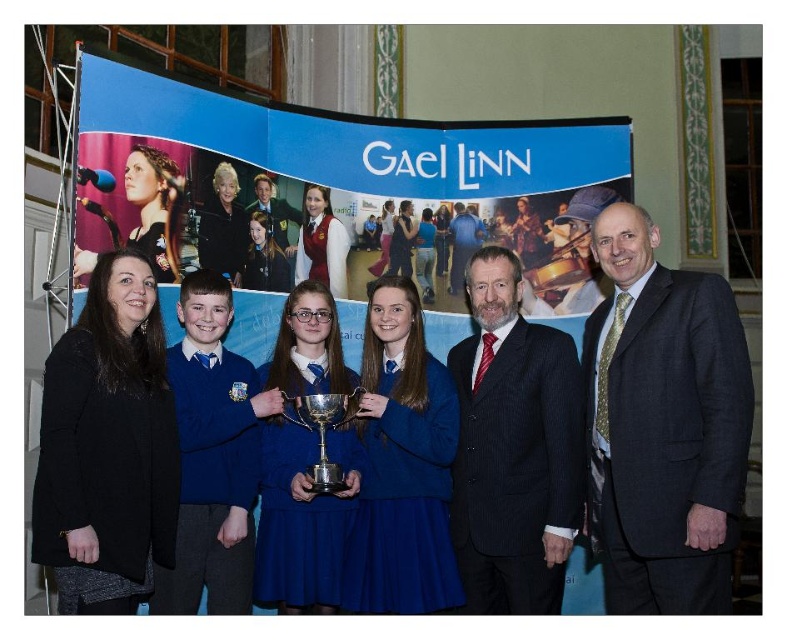
Question: Which of the following is the closest to the observer?

Choices:
 (A) (324, 548)
 (B) (625, 477)
 (C) (161, 440)
 (D) (457, 269)

Answer: (C)

Question: Is dark blue pinstripe suit at center positioned in front of blue fabric dress at center?

Choices:
 (A) no
 (B) yes

Answer: (A)

Question: Among these objects, which one is farthest from the camera?

Choices:
 (A) dark suit at center
 (B) blue fabric dress at center
 (C) blue school uniform at left

Answer: (A)

Question: Considering the real-world distances, which object is farthest from the silver polished trophy at center?

Choices:
 (A) blue fabric dress at center
 (B) blue school uniform at left
 (C) dark gray suit at right
 (D) dark suit at center

Answer: (C)

Question: Does blue school uniform at left have a lesser width compared to silver polished trophy at center?

Choices:
 (A) yes
 (B) no

Answer: (B)

Question: Can you confirm if dark blue pinstripe suit at center is bigger than blue fabric dress at center?

Choices:
 (A) no
 (B) yes

Answer: (B)